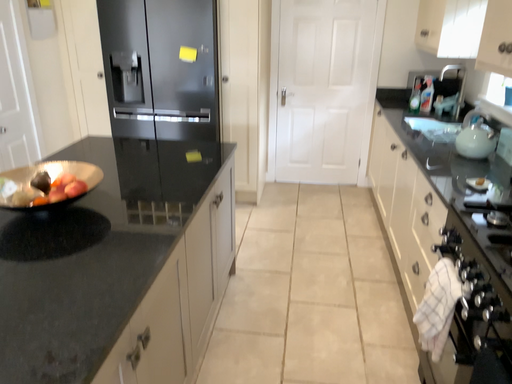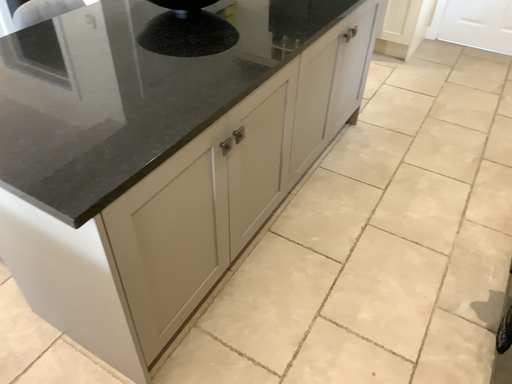
Question: Which way did the camera rotate in the video?

Choices:
 (A) rotated downward
 (B) rotated upward

Answer: (A)